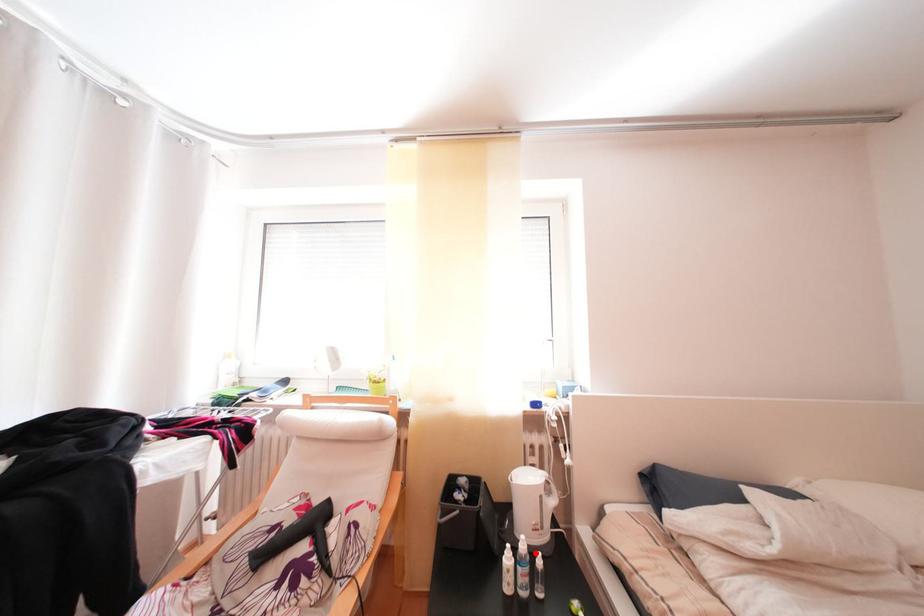
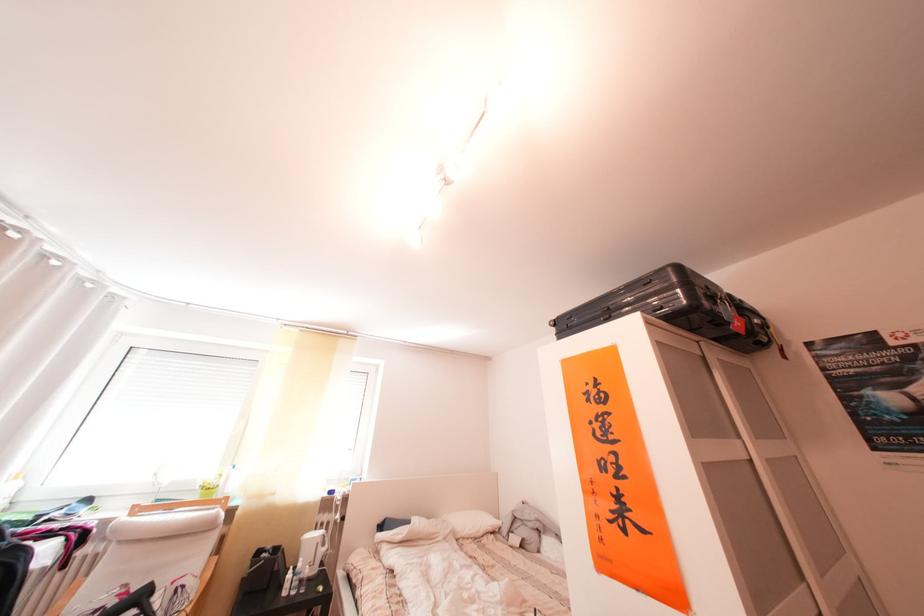
In the second image, find the point that corresponds to the highlighted location in the first image.

(312, 570)